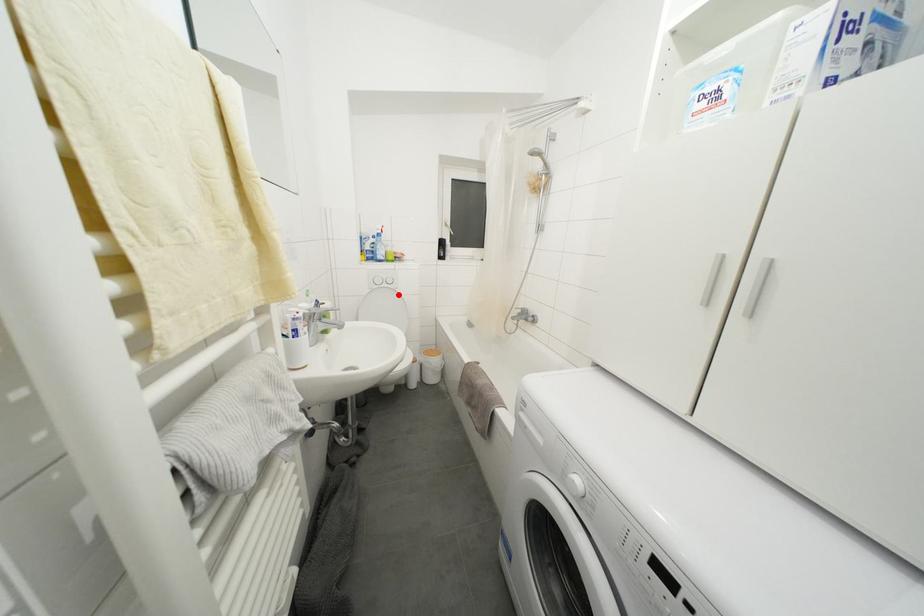
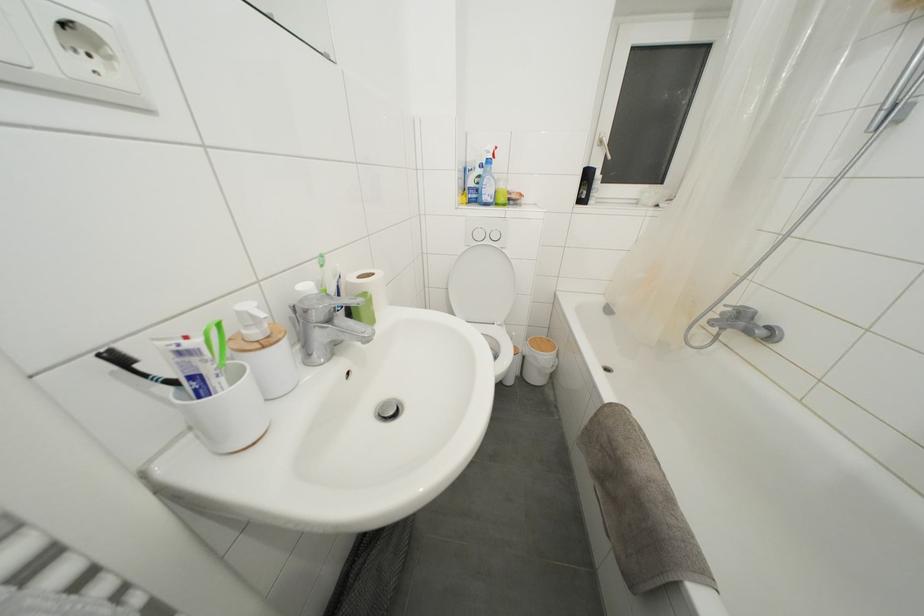
Find the pixel in the second image that matches the highlighted location in the first image.

(505, 256)